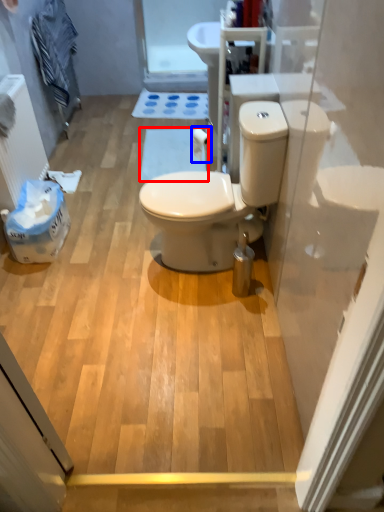
Question: Which point is closer to the camera, bath mat (highlighted by a red box) or toilet paper (highlighted by a blue box)?

Choices:
 (A) bath mat
 (B) toilet paper

Answer: (B)